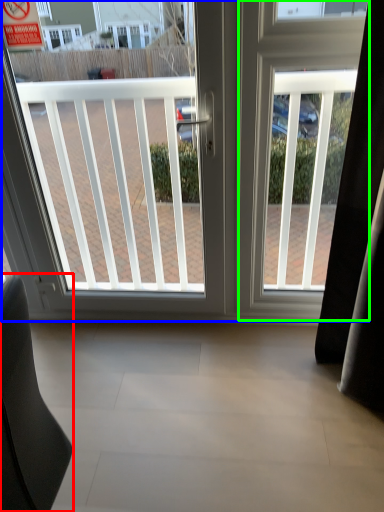
Question: Which is nearer to the furniture (highlighted by a red box)? window (highlighted by a blue box) or screen door (highlighted by a green box).

Choices:
 (A) window
 (B) screen door

Answer: (A)